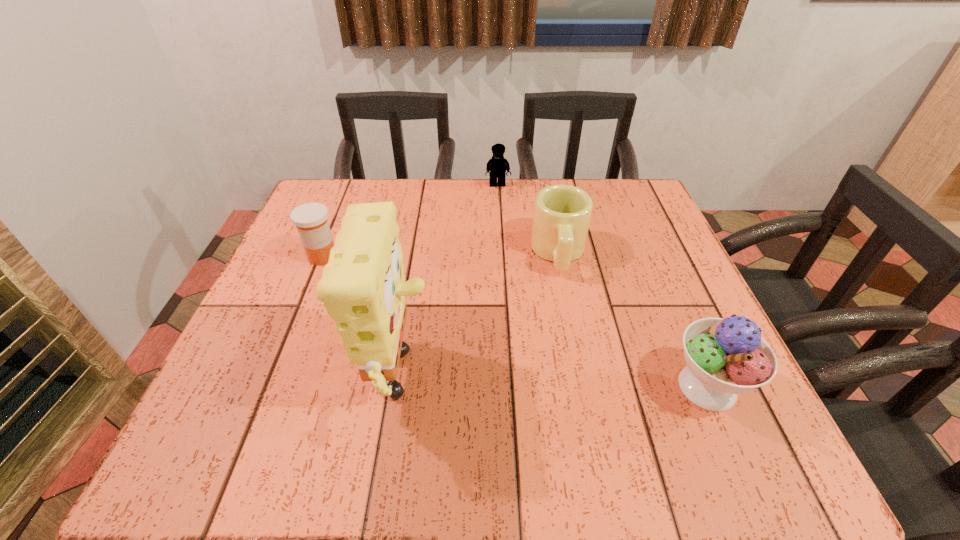
Find the location of a particular element. The width and height of the screenshot is (960, 540). vacant space at the far right corner is located at coordinates (655, 221).

What are the coordinates of `vacant space that is in between the medicine and the mug` in the screenshot? It's located at (441, 255).

In order to click on empty space between the medicine and the farthest object in this screenshot , I will do `click(410, 221)`.

The width and height of the screenshot is (960, 540). Find the location of `vacant space that's between the medicine and the icecream`. vacant space that's between the medicine and the icecream is located at coordinates (515, 321).

Identify the location of free spot between the rightmost object and the farthest object. This screenshot has width=960, height=540. (603, 286).

The height and width of the screenshot is (540, 960). In order to click on vacant area between the medicine and the farthest object in this screenshot , I will do `click(410, 221)`.

In order to click on free space between the second tallest object and the mug in this screenshot , I will do `click(633, 320)`.

The height and width of the screenshot is (540, 960). Find the location of `empty space that is in between the medicine and the Lego`. empty space that is in between the medicine and the Lego is located at coordinates (410, 221).

The image size is (960, 540). Identify the location of unoccupied position between the Lego and the icecream. [603, 286].

Select which object is the second closest to the tallest object. Please provide its 2D coordinates. Your answer should be formatted as a tuple, i.e. [(x, y)], where the tuple contains the x and y coordinates of a point satisfying the conditions above.

[(562, 213)]